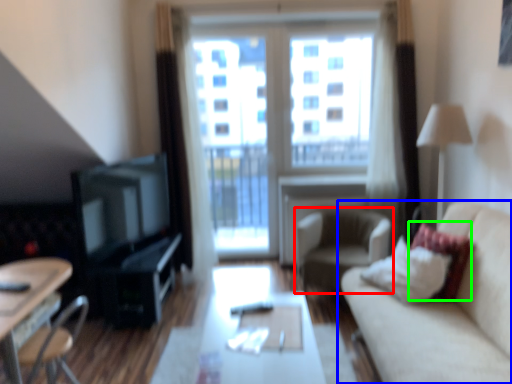
Question: Which object is the closest to the chair (highlighted by a red box)? Choose among these: studio couch (highlighted by a blue box) or pillow (highlighted by a green box).

Choices:
 (A) studio couch
 (B) pillow

Answer: (B)